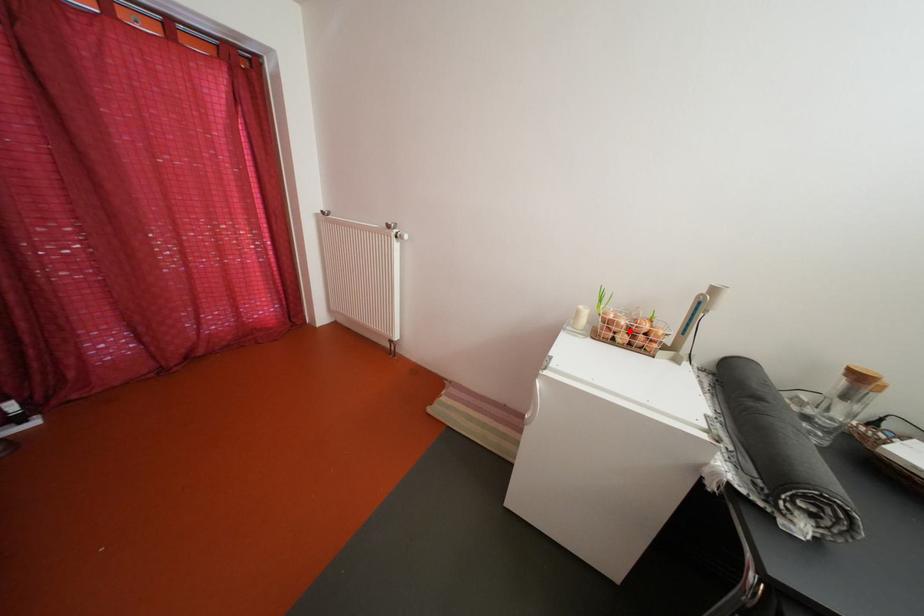
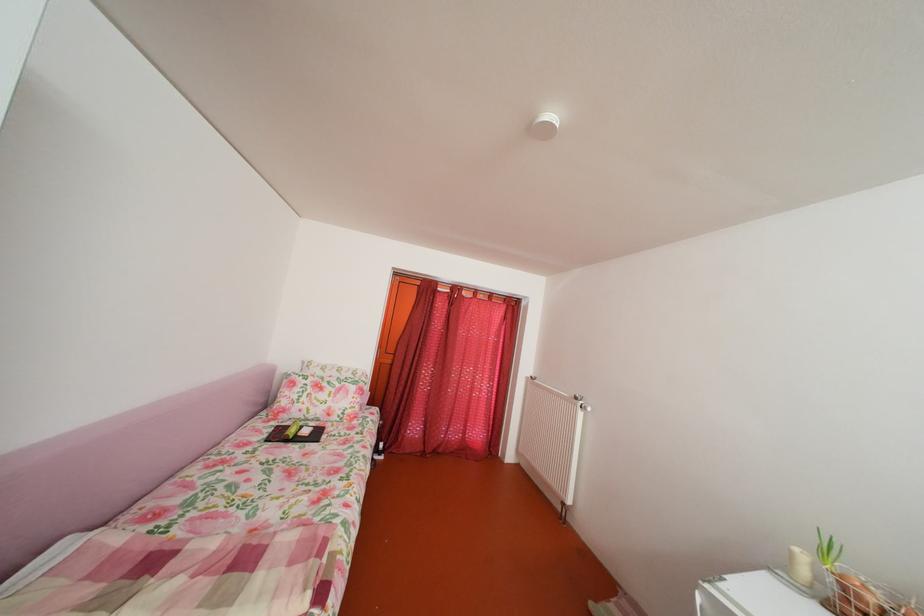
Where in the second image is the point corresponding to the highlighted location from the first image?

(871, 605)